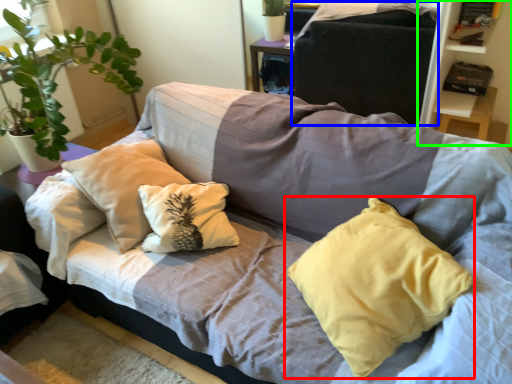
Question: Considering the real-world distances, which object is farthest from pillow (highlighted by a red box)? gray (highlighted by a blue box) or bookshelf (highlighted by a green box)?

Choices:
 (A) gray
 (B) bookshelf

Answer: (A)